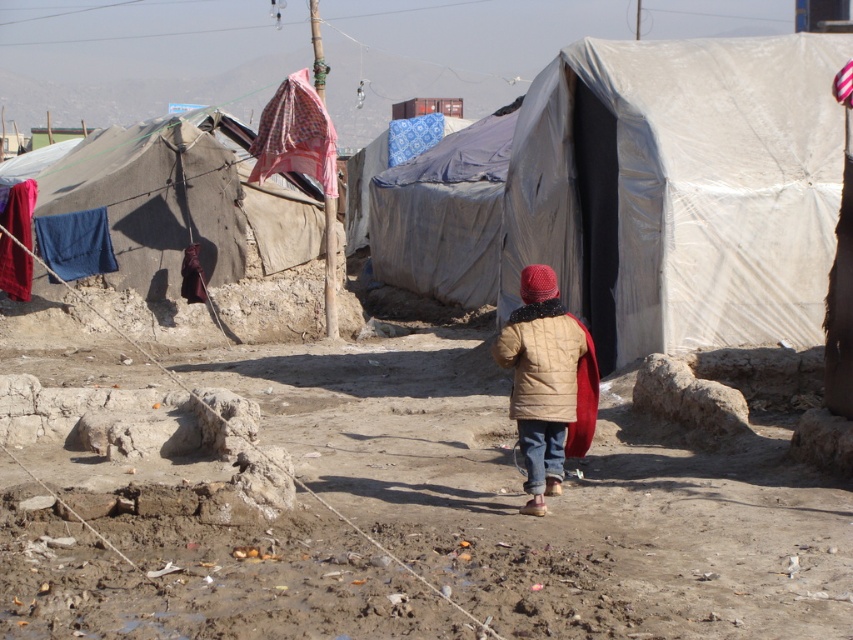
Question: Estimate the real-world distances between objects in this image. Which object is closer to the blue fabric at left?

Choices:
 (A) brown quilted jacket at center
 (B) beige canvas tent at left
 (C) brown dirt field at center
 (D) patterned fabric at upper center

Answer: (B)

Question: Among these points, which one is farthest from the camera?

Choices:
 (A) (48, 230)
 (B) (657, 433)

Answer: (A)

Question: Can you confirm if blue tarpaulin tent at center is smaller than matte beige jacket at center?

Choices:
 (A) no
 (B) yes

Answer: (A)

Question: Where is matte beige jacket at center located in relation to patterned fabric at upper center in the image?

Choices:
 (A) left
 (B) right

Answer: (B)

Question: Can you confirm if patterned fabric at upper center is positioned to the left of blue fabric at left?

Choices:
 (A) no
 (B) yes

Answer: (A)

Question: Which object appears closest to the camera in this image?

Choices:
 (A) patterned fabric at upper center
 (B) beige canvas tent at left
 (C) brown quilted jacket at center
 (D) white tarpaulin tent at center

Answer: (C)